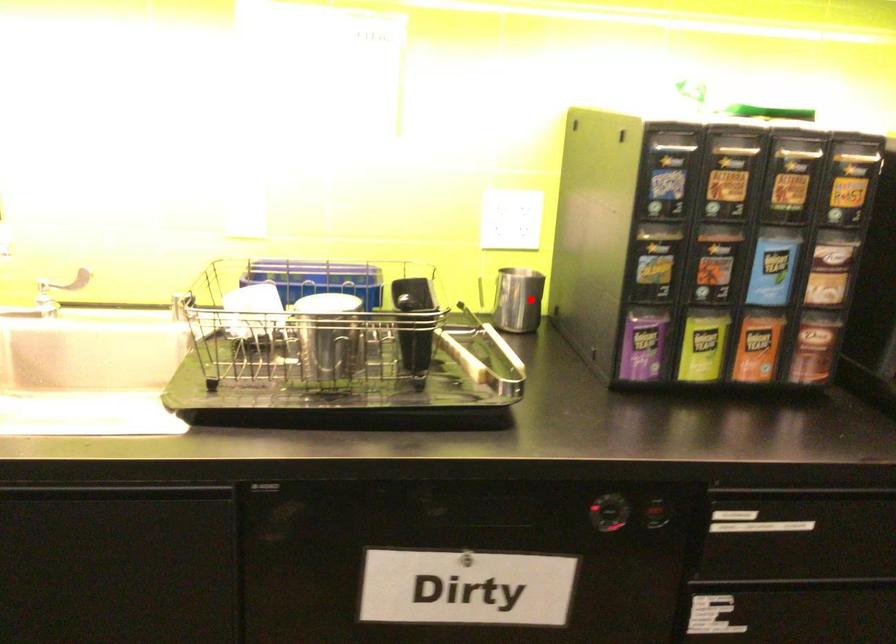
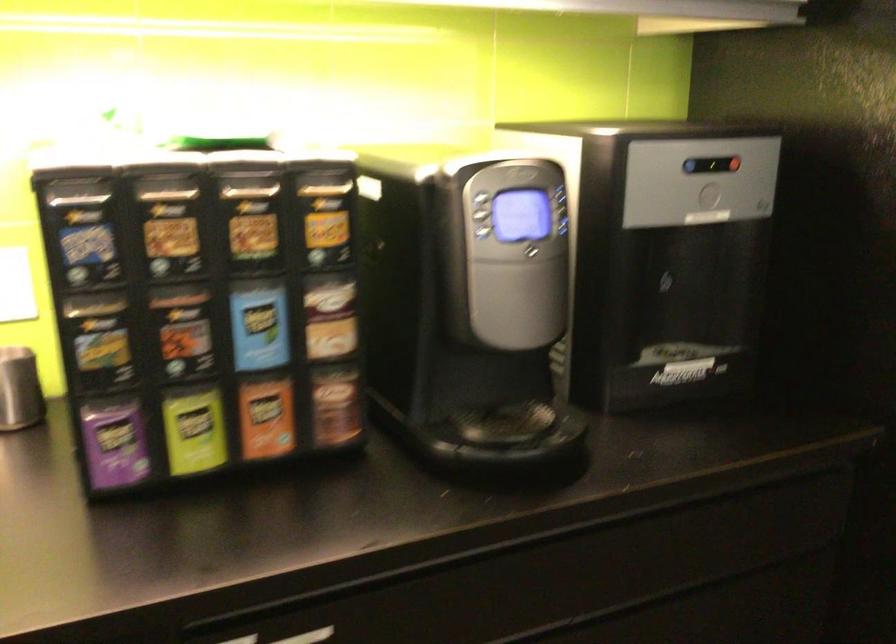
Where in the second image is the point corresponding to the highlighted location from the first image?

(19, 389)